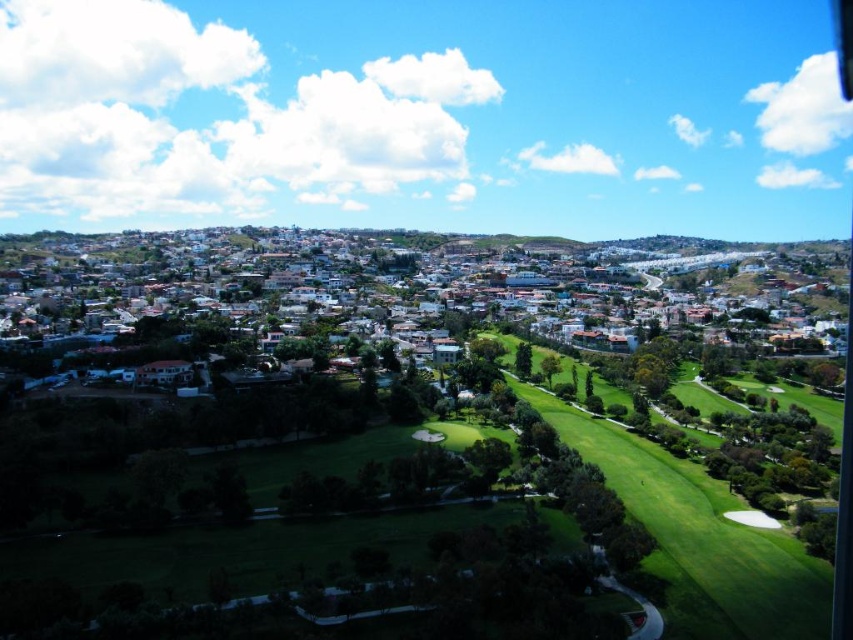
You are a golfer standing on the green grassy golf course at center and want to hit a ball towards the white matte houses at center. Considering their relative heights, will the houses be visible over the course?

The white matte houses at center are taller than the green grassy golf course at center, so yes, the houses will be visible over the course.

You are a drone operator tasked with capturing aerial footage of the golf course. You need to ensure that the white matte houses at center do not appear in the shot. Based on their coordinates, can you position the camera so that the houses are out of frame?

The white matte houses at center are located at coordinates point (389,275). By adjusting the camera angle or position to avoid this area, it is possible to exclude them from the frame.

You are a landscape architect planning to redesign the golf course. You need to decide whether to expand the green grassy golf course at center or the white matte houses at center. Based on their sizes, which area should you prioritize for expansion?

The white matte houses at center is bigger than the green grassy golf course at center, so you should prioritize expanding the white matte houses at center since it has more space available for expansion.